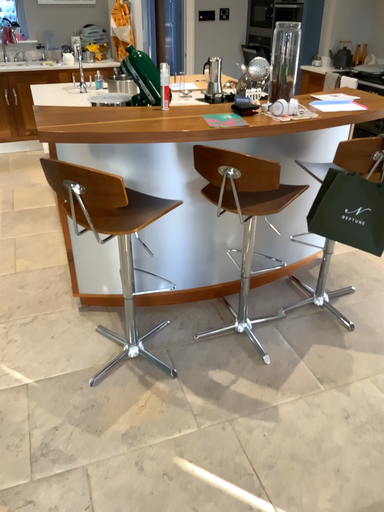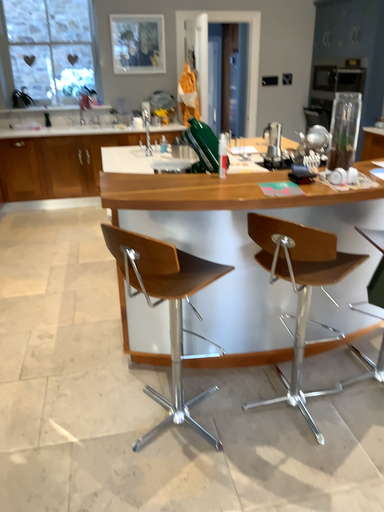
Question: Which way did the camera rotate in the video?

Choices:
 (A) rotated upward
 (B) rotated downward

Answer: (A)